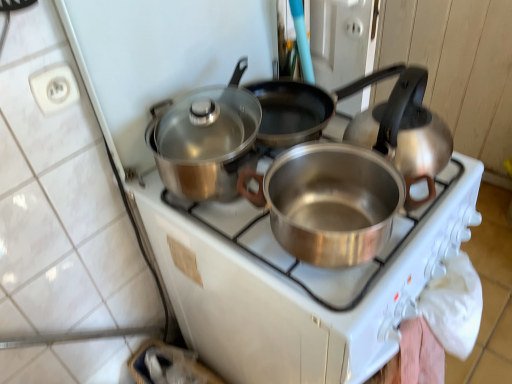
What do you see at coordinates (61, 203) in the screenshot?
I see `matte white stove at center` at bounding box center [61, 203].

What is the approximate width of shiny metallic pot at center?

The width of shiny metallic pot at center is 10.46 inches.

In order to face silver metallic pot at center, should I rotate leftwards or rightwards?

To align with it, rotate right about 10.302°.

The height and width of the screenshot is (384, 512). I want to click on matte white stove at center, so click(61, 203).

How many degrees apart are the facing directions of matte white stove at center and satin silver kettle at right?

The angular difference between matte white stove at center and satin silver kettle at right is 2.71 degrees.

Is matte white stove at center inside or outside of satin silver kettle at right?

matte white stove at center is outside satin silver kettle at right.

Does matte white stove at center come behind satin silver kettle at right?

No, it is in front of satin silver kettle at right.

Is satin silver kettle at right wider or thinner than matte white stove at center?

satin silver kettle at right is wider than matte white stove at center.

Would you say satin silver kettle at right is a long distance from matte white stove at center?

No, satin silver kettle at right is not far from matte white stove at center.

Between satin silver kettle at right and matte white stove at center, which one has less height?

With less height is satin silver kettle at right.

From a real-world perspective, does satin silver kettle at right sit lower than matte white stove at center?

No.

Is point (451, 135) closer to viewer compared to point (176, 119)?

No.

Between satin silver kettle at right and shiny metallic pot at center, which one appears on the left side from the viewer's perspective?

Positioned to the left is shiny metallic pot at center.

Does satin silver kettle at right have a lesser height compared to shiny metallic pot at center?

No.

Based on the photo, are satin silver kettle at right and shiny metallic pot at center far apart?

satin silver kettle at right is near shiny metallic pot at center, not far away.

From the image's perspective, which object appears higher, matte white stove at center or shiny metallic pot at center?

shiny metallic pot at center.

Is matte white stove at center positioned with its back to shiny metallic pot at center?

Yes, matte white stove at center is positioned with its back facing shiny metallic pot at center.

Can we say matte white stove at center lies outside shiny metallic pot at center?

matte white stove at center is positioned outside shiny metallic pot at center.

Is matte white stove at center not near shiny metallic pot at center?

matte white stove at center is actually quite close to shiny metallic pot at center.

From the image's perspective, is silver metallic pot at center above or below matte white stove at center?

silver metallic pot at center is situated lower than matte white stove at center in the image.

Can we say silver metallic pot at center lies outside matte white stove at center?

silver metallic pot at center lies outside matte white stove at center's area.

Considering the sizes of objects silver metallic pot at center and matte white stove at center in the image provided, who is taller, silver metallic pot at center or matte white stove at center?

matte white stove at center.

Does silver metallic pot at center touch matte white stove at center?

No, silver metallic pot at center is not in contact with matte white stove at center.

Would you say silver metallic pot at center is a long distance from shiny metallic pot at center?

silver metallic pot at center is actually quite close to shiny metallic pot at center.

Considering the sizes of objects silver metallic pot at center and shiny metallic pot at center in the image provided, who is shorter, silver metallic pot at center or shiny metallic pot at center?

shiny metallic pot at center.

Is point (247, 235) farther from camera compared to point (211, 127)?

No, it is in front of (211, 127).

Based on the photo, is silver metallic pot at center taller than satin silver kettle at right?

No.

Is satin silver kettle at right at the back of silver metallic pot at center?

No.

From the image's perspective, who appears lower, silver metallic pot at center or satin silver kettle at right?

silver metallic pot at center is shown below in the image.

Find the location of a particular element. This screenshot has width=512, height=384. tile located below the satin silver kettle at right (from the image's perspective) is located at coordinates (61, 203).

This screenshot has width=512, height=384. I want to click on kettle that appears above the matte white stove at center (from the image's perspective), so click(403, 129).

Which object lies nearer to the anchor point satin silver kettle at right, shiny metallic pot at center or silver metallic pot at center?

silver metallic pot at center is positioned closer to the anchor satin silver kettle at right.

From the image, which object appears to be farther from satin silver kettle at right, matte white stove at center or silver metallic pot at center?

Among the two, matte white stove at center is located further to satin silver kettle at right.

When comparing their distances from satin silver kettle at right, does matte white stove at center or shiny metallic pot at center seem closer?

Among the two, shiny metallic pot at center is located nearer to satin silver kettle at right.

When comparing their distances from shiny metallic pot at center, does silver metallic pot at center or satin silver kettle at right seem closer?

silver metallic pot at center lies closer to shiny metallic pot at center than the other object.

Looking at the image, which one is located further to silver metallic pot at center, shiny metallic pot at center or satin silver kettle at right?

shiny metallic pot at center lies further to silver metallic pot at center than the other object.

Looking at the image, which one is located closer to shiny metallic pot at center, satin silver kettle at right or matte white stove at center?

satin silver kettle at right.

When comparing their distances from silver metallic pot at center, does satin silver kettle at right or matte white stove at center seem closer?

The object closer to silver metallic pot at center is satin silver kettle at right.

Estimate the real-world distances between objects in this image. Which object is closer to matte white stove at center, silver metallic pot at center or shiny metallic pot at center?

Among the two, shiny metallic pot at center is located nearer to matte white stove at center.

The image size is (512, 384). Find the location of `kitchen appliance between matte white stove at center and silver metallic pot at center from left to right`. kitchen appliance between matte white stove at center and silver metallic pot at center from left to right is located at coordinates (206, 140).

I want to click on gas stove between matte white stove at center and satin silver kettle at right in the horizontal direction, so click(x=348, y=268).

The image size is (512, 384). Find the location of `gas stove between shiny metallic pot at center and satin silver kettle at right`. gas stove between shiny metallic pot at center and satin silver kettle at right is located at coordinates (348, 268).

I want to click on kitchen appliance between matte white stove at center and satin silver kettle at right in the horizontal direction, so click(x=206, y=140).